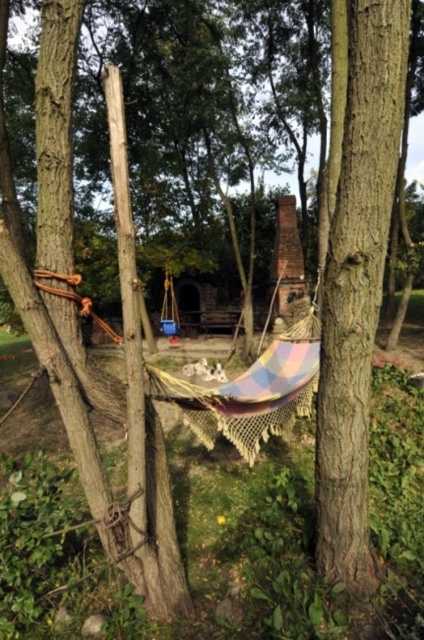
You are planning to hang a birdhouse between the smooth brown tree trunk at center and the rough wood tree trunk at left. Based on their positions, which tree trunk should the birdhouse be closer to?

The smooth brown tree trunk at center is to the right of the rough wood tree trunk at left, so the birdhouse should be closer to the smooth brown tree trunk at center to maintain symmetry between the two tree trunks.

You are a bird looking for a place to perch. You see the smooth brown tree trunk at center and the rough wood tree trunk at left. Which one is higher up from the ground?

The smooth brown tree trunk at center is located above the rough wood tree trunk at left, so it is higher up from the ground.

You are planning to hang a large birdhouse between the smooth brown tree trunk at center and the rough wood tree trunk at left. Which tree trunk would you choose to attach the birdhouse to if you want it to be more visible from the front of the scene?

The rough wood tree trunk at left is larger in size compared to the smooth brown tree trunk at center, so attaching the birdhouse to the rough wood tree trunk at left would make it more visible from the front of the scene.